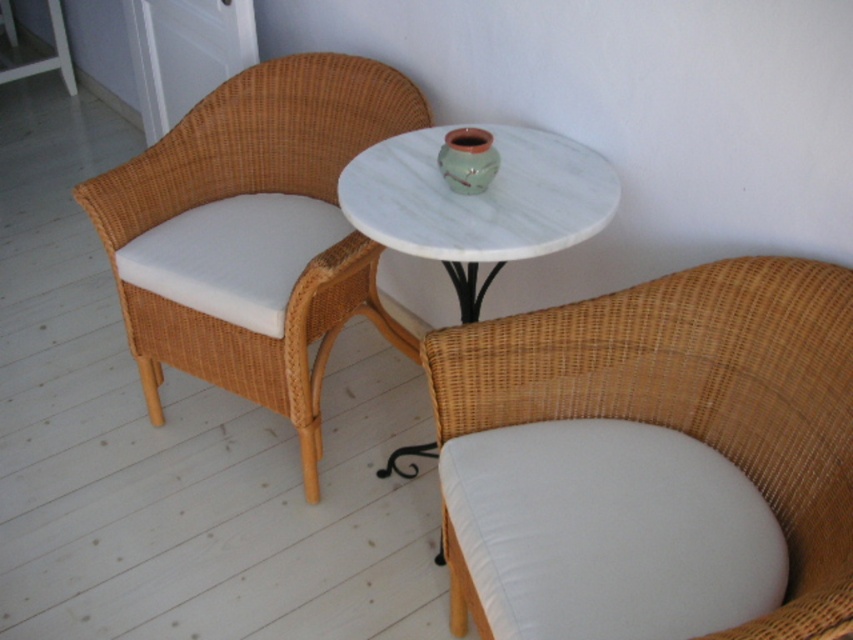
You are standing in the cozy corner setup and want to place a small item on the table between the two wicker chairs. The table has coordinates marked as point A at (791, 268) and point B at (469, 243). Which point, A or B, is closer to you if you are facing the table?

Point A at (791, 268) is in front of point B at (469, 243), so if you are facing the table, point A is closer to you.